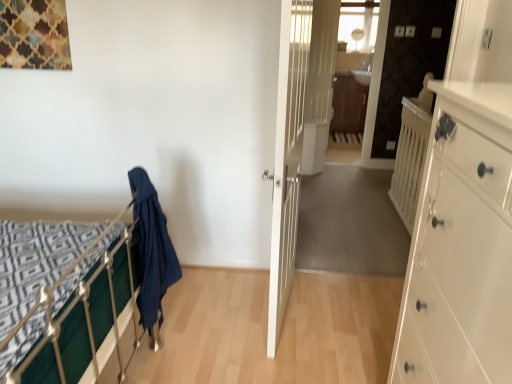
Question: In terms of size, does white glossy chest of drawers at right appear bigger or smaller than white glossy door at center, marked as the 1th door in a back-to-front arrangement?

Choices:
 (A) big
 (B) small

Answer: (A)

Question: Would you say white glossy chest of drawers at right is to the left or to the right of white glossy door at center, which appears as the 2th door when viewed from the left, in the picture?

Choices:
 (A) right
 (B) left

Answer: (B)

Question: Which of these objects is positioned farthest from the white glossy chest of drawers at right?

Choices:
 (A) dark blue fabric at left
 (B) white wooden door at center, the 2th door viewed from the right
 (C) white glossy door at center, the 1th door when ordered from right to left
 (D) brown wood/file cabinet at center
 (E) white wooden balustrade at right

Answer: (D)

Question: Which object is positioned closest to the dark blue fabric at left?

Choices:
 (A) white glossy door at center, the second door when ordered from front to back
 (B) brown wood/file cabinet at center
 (C) white glossy chest of drawers at right
 (D) white wooden door at center, positioned as the 1th door in front-to-back order
 (E) white wooden balustrade at right

Answer: (C)